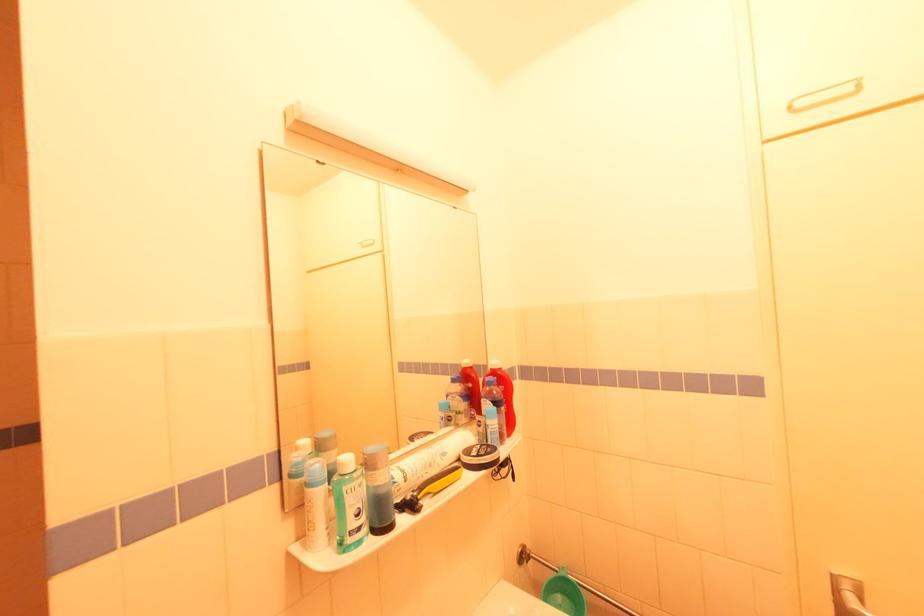
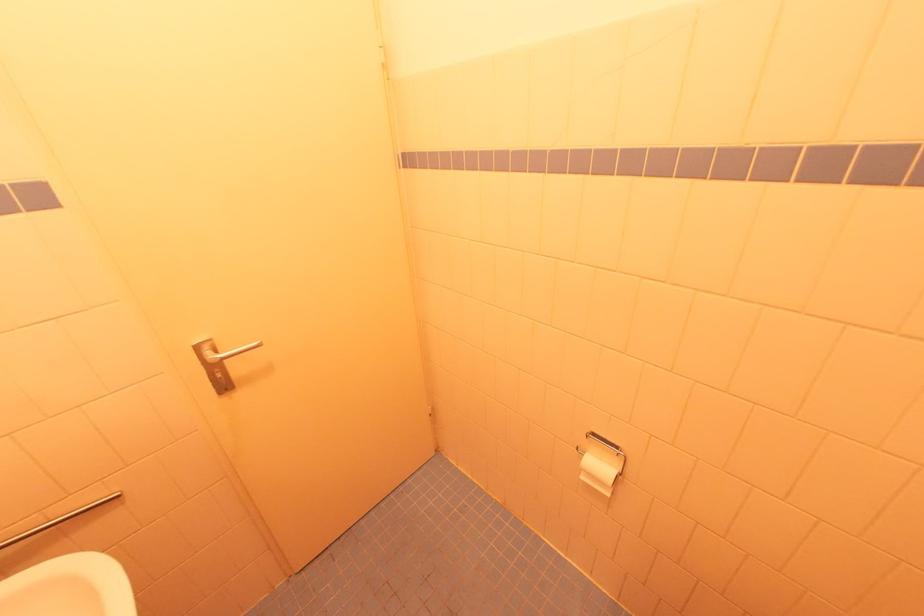
Locate, in the second image, the point that corresponds to the point at 835,573 in the first image.

(197, 345)